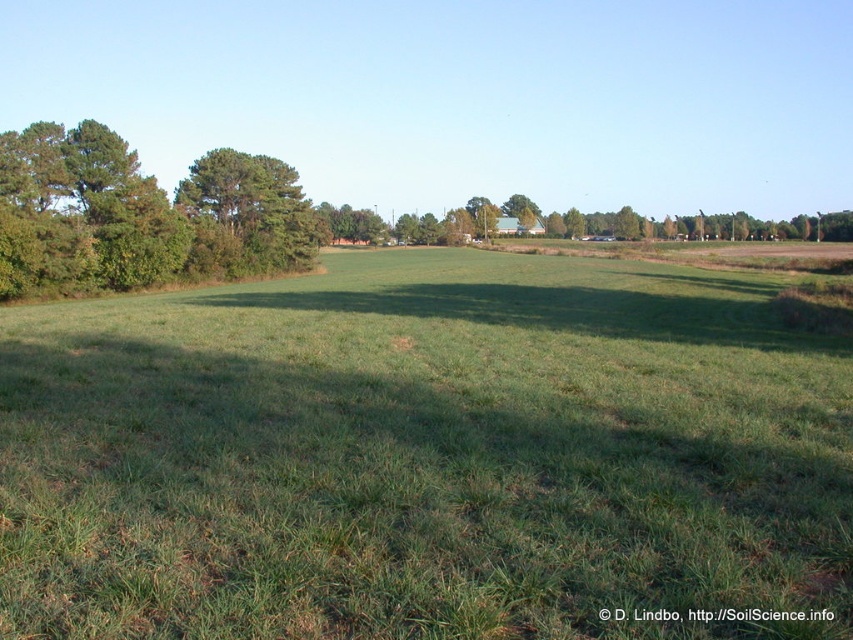
You are a gardener planning to mow the green grass at center and trim the green leafy trees at left. Based on the scene, which area requires a wider mower path to cover its entire width?

The green grass at center requires a wider mower path because its width surpasses that of the green leafy trees at left.